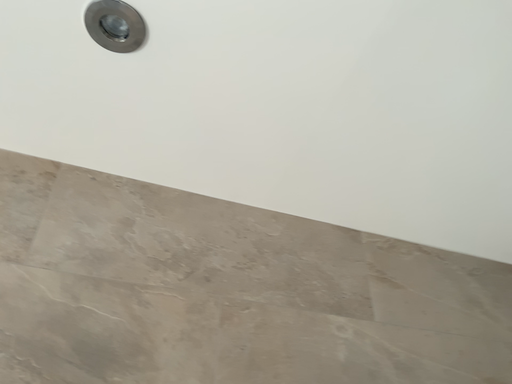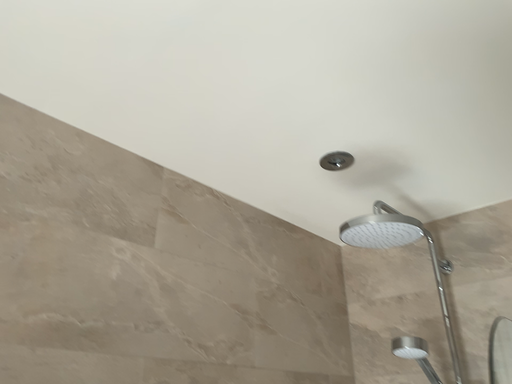
Question: Which way did the camera rotate in the video?

Choices:
 (A) rotated right
 (B) rotated left

Answer: (A)